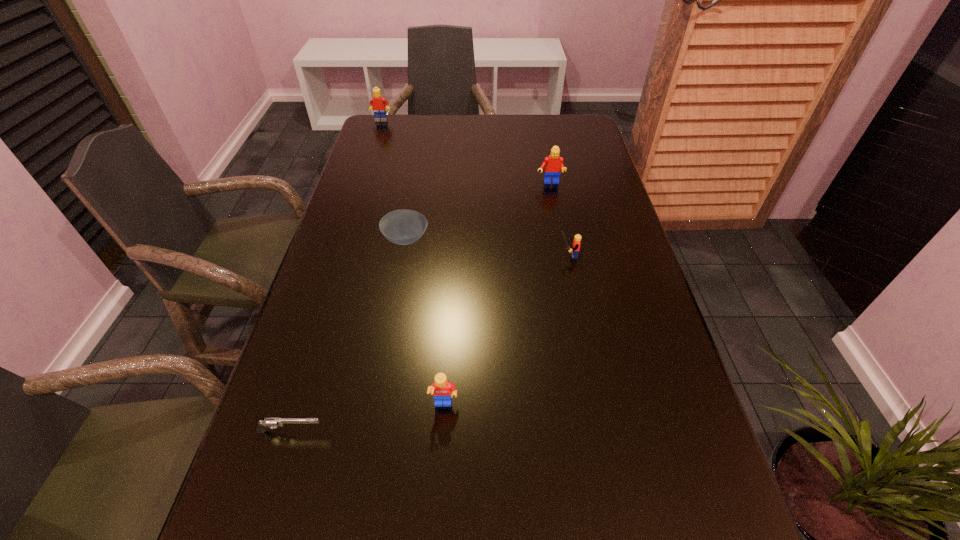
This screenshot has width=960, height=540. I want to click on free space that satisfies the following two spatial constraints: 1. on the face of the nearest Lego; 2. on the front-facing side of the nearest object, so click(x=443, y=431).